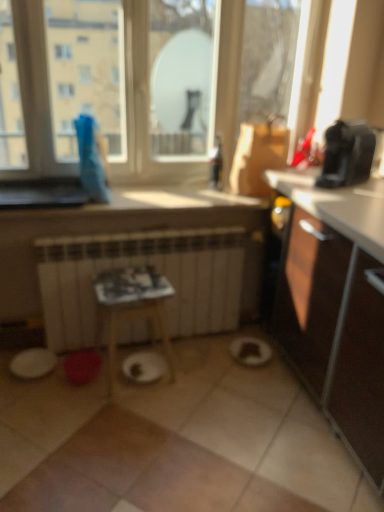
Question: From the image's perspective, is transparent glass window at upper center positioned above or below black plastic coffee maker at upper right?

Choices:
 (A) above
 (B) below

Answer: (A)

Question: Looking at the image, does transparent glass window at upper center seem bigger or smaller compared to black plastic coffee maker at upper right?

Choices:
 (A) big
 (B) small

Answer: (A)

Question: Considering the real-world distances, which object is farthest from the black plastic coffee maker at upper right?

Choices:
 (A) transparent glass window at upper center
 (B) white matte radiator at center
 (C) wooden table at center
 (D) white matte paper plate at center

Answer: (D)

Question: Considering the real-world distances, which object is closest to the black plastic coffee maker at upper right?

Choices:
 (A) wooden table at center
 (B) white matte paper plate at center
 (C) transparent glass window at upper center
 (D) white matte radiator at center

Answer: (C)